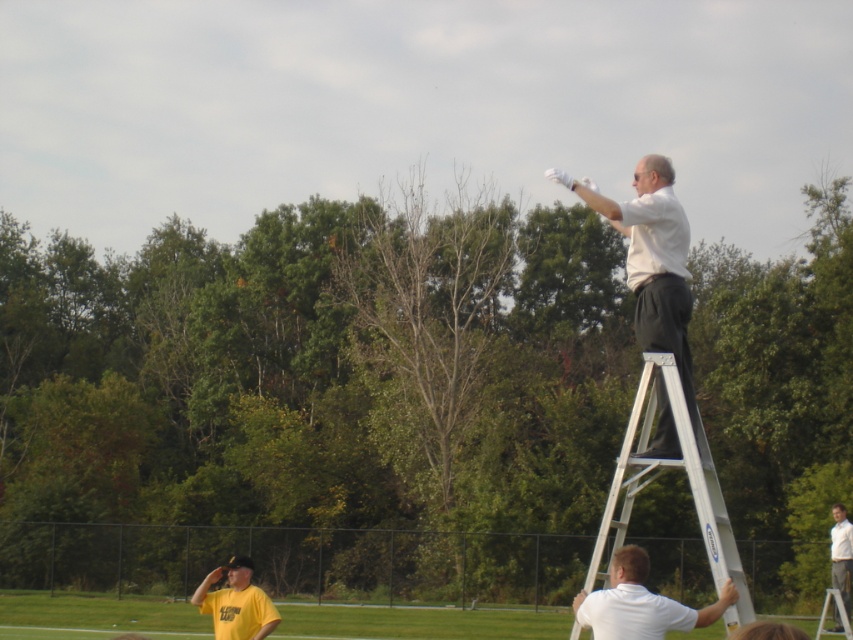
You are a photographer trying to capture the man on the ladder in the scene. You notice a point at coordinates (653, 259). What object is located at this point?

The point at coordinates (653, 259) corresponds to the white matte shirt at upper right.

You are a photographer trying to capture a photo of the silver metallic ladder at upper right and the white matte shirt at lower right. To ensure both are in the frame, where should you position yourself relative to the scene?

You should position yourself to the left of the scene so that the silver metallic ladder at upper right and the white matte shirt at lower right are both visible in the frame since the ladder is on the right side of the shirt.